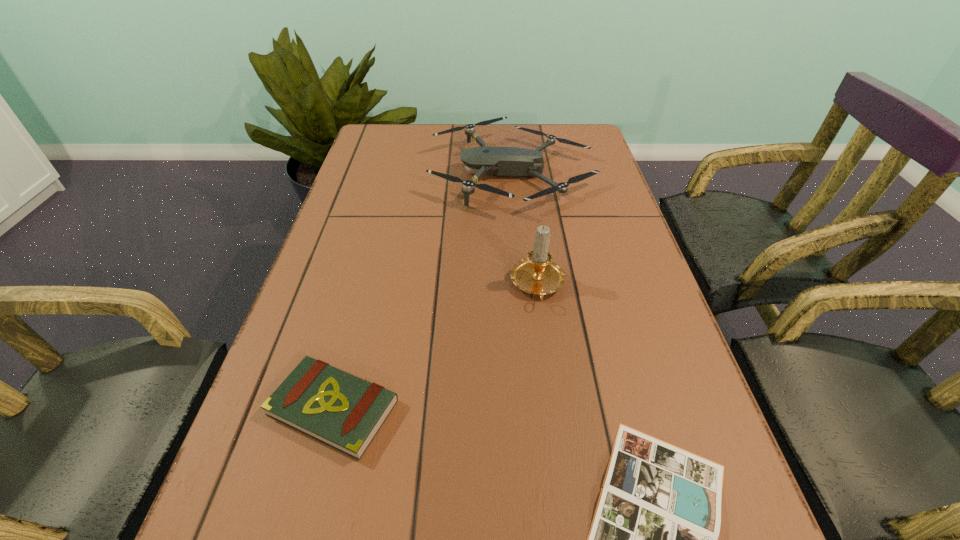
Identify the location of unoccupied area between the third shortest object and the taller book. (422, 291).

Where is `free space between the drone and the second shortest object`? This screenshot has width=960, height=540. free space between the drone and the second shortest object is located at coordinates (422, 291).

Identify the location of vacant area between the drone and the taller book. This screenshot has height=540, width=960. (422, 291).

Where is `vacant point located between the second shortest object and the third shortest object`? vacant point located between the second shortest object and the third shortest object is located at coordinates (422, 291).

Locate an element on the screen. the third closest object to the shortest object is located at coordinates (498, 161).

You are a GUI agent. You are given a task and a screenshot of the screen. Output one action in this format:
    pyautogui.click(x=<x>, y=<y>)
    Task: Click on the object that is the second closest one to the shortest object
    The width and height of the screenshot is (960, 540).
    Given the screenshot: What is the action you would take?
    pyautogui.click(x=345, y=412)

This screenshot has height=540, width=960. Find the location of `blank space that satisfies the following two spatial constraints: 1. with a camera mounted on the front of the third nearest object; 2. on the right side of the drone`. blank space that satisfies the following two spatial constraints: 1. with a camera mounted on the front of the third nearest object; 2. on the right side of the drone is located at coordinates tap(523, 286).

The height and width of the screenshot is (540, 960). In order to click on free location that satisfies the following two spatial constraints: 1. with a camera mounted on the front of the tallest object; 2. on the right side of the drone in this screenshot , I will do `click(523, 286)`.